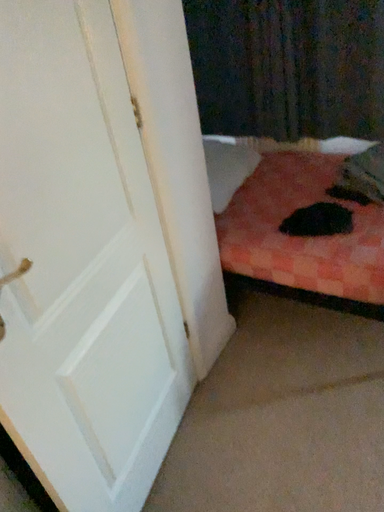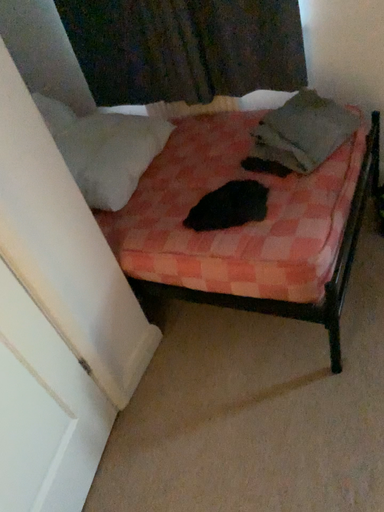
Question: How did the camera likely rotate when shooting the video?

Choices:
 (A) rotated upward
 (B) rotated downward

Answer: (B)